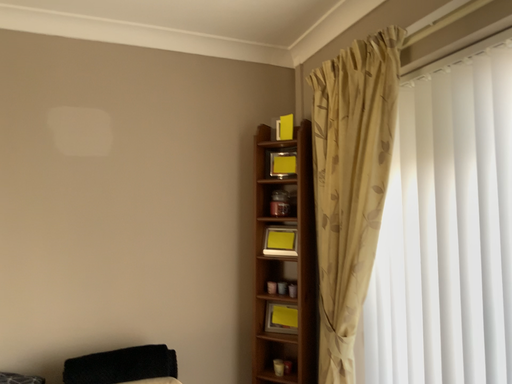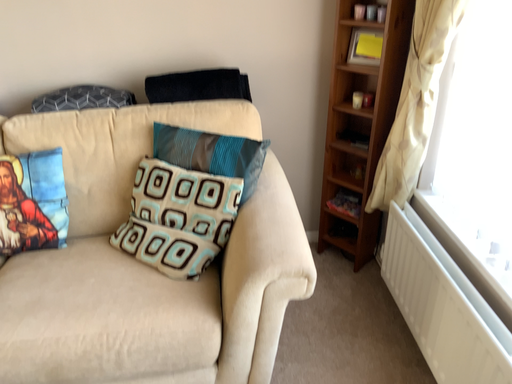
Question: How did the camera likely rotate when shooting the video?

Choices:
 (A) rotated left
 (B) rotated right

Answer: (A)